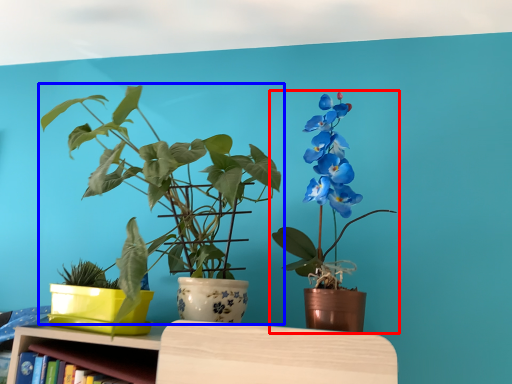
Question: Which of the following is the farthest to the observer, houseplant (highlighted by a red box) or houseplant (highlighted by a blue box)?

Choices:
 (A) houseplant
 (B) houseplant

Answer: (A)